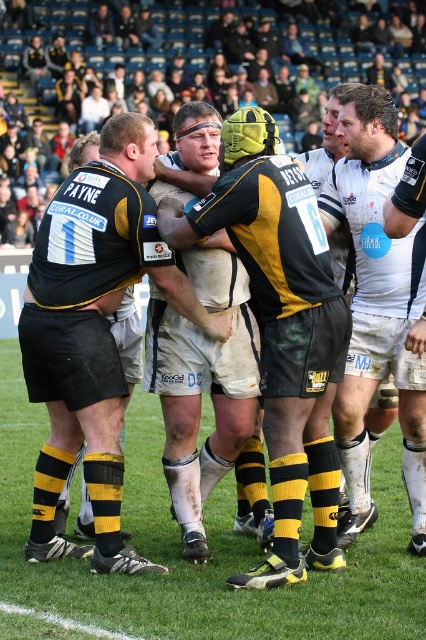
Question: Among these points, which one is nearest to the camera?

Choices:
 (A) (388, 301)
 (B) (103, 404)

Answer: (B)

Question: Which object appears closest to the camera in this image?

Choices:
 (A) black matte jersey at center
 (B) white jersey at center
 (C) yellow and black rugby jersey at center

Answer: (C)

Question: Can you confirm if black matte jersey at center is bigger than white jersey at center?

Choices:
 (A) yes
 (B) no

Answer: (A)

Question: Observing the image, what is the correct spatial positioning of yellow and black rugby jersey at center in reference to white jersey at center?

Choices:
 (A) right
 (B) left

Answer: (B)

Question: Which object is farther from the camera taking this photo?

Choices:
 (A) white jersey at center
 (B) black matte jersey at center
 (C) yellow and black rugby jersey at center

Answer: (A)

Question: In this image, where is yellow and black rugby jersey at center located relative to white jersey at center?

Choices:
 (A) left
 (B) right

Answer: (A)